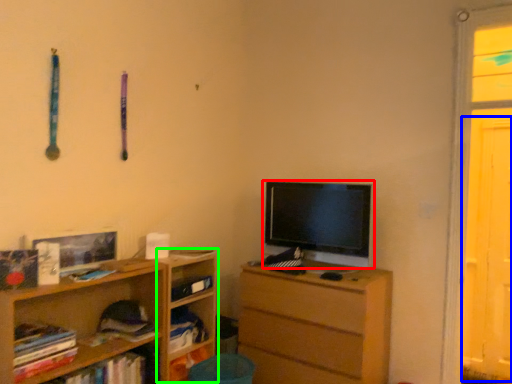
Question: Considering the real-world distances, which object is closest to television (highlighted by a red box)? screen door (highlighted by a blue box) or shelf (highlighted by a green box).

Choices:
 (A) screen door
 (B) shelf

Answer: (B)